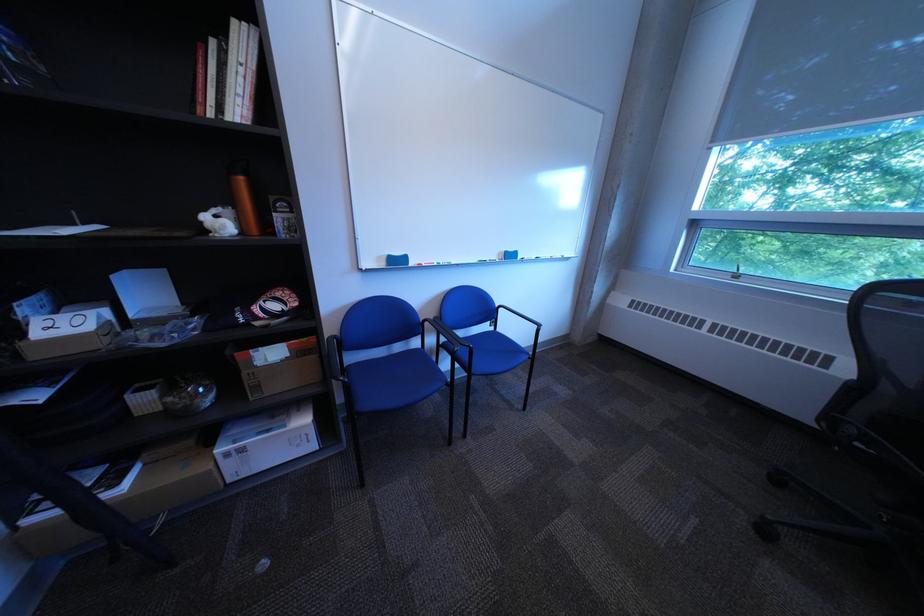
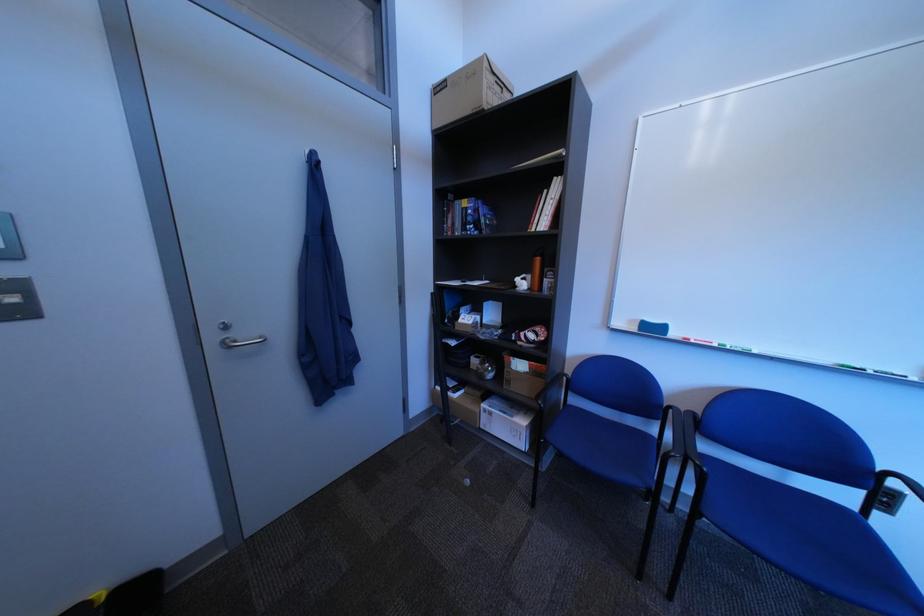
Where in the second image is the point corresponding to (x=274, y=387) from the first image?

(525, 383)